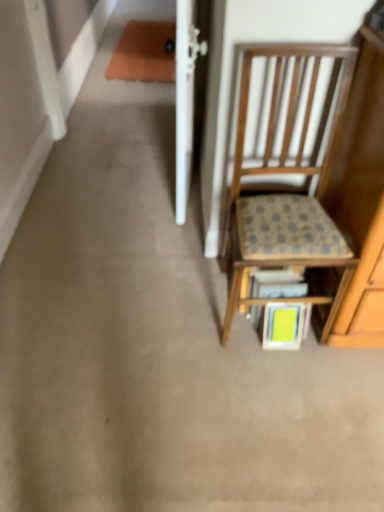
Question: From a real-world perspective, is wooden chair with cushion at right located beneath green matte book at lower center?

Choices:
 (A) no
 (B) yes

Answer: (A)

Question: Would you say wooden chair with cushion at right is a long distance from green matte book at lower center?

Choices:
 (A) yes
 (B) no

Answer: (B)

Question: Would you say green matte book at lower center is part of wooden chair with cushion at right's contents?

Choices:
 (A) yes
 (B) no

Answer: (A)

Question: From the image's perspective, is wooden chair with cushion at right over green matte book at lower center?

Choices:
 (A) yes
 (B) no

Answer: (A)

Question: Can you confirm if wooden chair with cushion at right is positioned to the right of green matte book at lower center?

Choices:
 (A) no
 (B) yes

Answer: (A)

Question: From a real-world perspective, is green matte book at lower center physically located above or below wooden chair with cushion at right?

Choices:
 (A) above
 (B) below

Answer: (B)

Question: In the image, is green matte book at lower center positioned in front of or behind wooden chair with cushion at right?

Choices:
 (A) behind
 (B) front

Answer: (A)

Question: Would you say green matte book at lower center is inside or outside wooden chair with cushion at right?

Choices:
 (A) outside
 (B) inside

Answer: (B)

Question: From the image's perspective, is green matte book at lower center located above or below wooden chair with cushion at right?

Choices:
 (A) above
 (B) below

Answer: (B)

Question: Does point (324, 307) appear closer or farther from the camera than point (324, 220)?

Choices:
 (A) farther
 (B) closer

Answer: (A)

Question: From their relative heights in the image, would you say wooden textured shelf at center is taller or shorter than wooden chair with cushion at right?

Choices:
 (A) short
 (B) tall

Answer: (A)

Question: Considering the relative positions of wooden textured shelf at center and wooden chair with cushion at right in the image provided, is wooden textured shelf at center to the left or to the right of wooden chair with cushion at right?

Choices:
 (A) right
 (B) left

Answer: (B)

Question: Is wooden textured shelf at center inside the boundaries of wooden chair with cushion at right, or outside?

Choices:
 (A) inside
 (B) outside

Answer: (A)

Question: From the image's perspective, is green matte book at lower center located above or below wooden textured shelf at center?

Choices:
 (A) below
 (B) above

Answer: (A)

Question: Would you say green matte book at lower center is to the left or to the right of wooden textured shelf at center in the picture?

Choices:
 (A) left
 (B) right

Answer: (B)